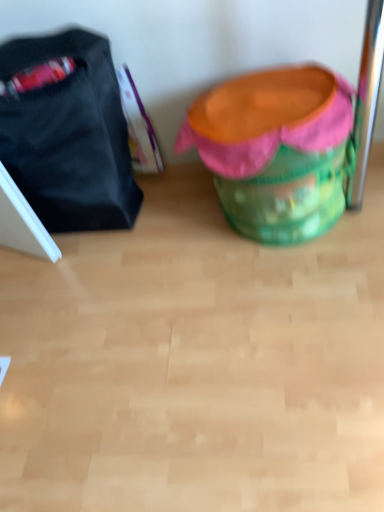
Question: Is green fabric bean bag chair at center to the left or to the right of matte black bag at left in the image?

Choices:
 (A) left
 (B) right

Answer: (B)

Question: From their relative heights in the image, would you say green fabric bean bag chair at center is taller or shorter than matte black bag at left?

Choices:
 (A) tall
 (B) short

Answer: (B)

Question: From a real-world perspective, is green fabric bean bag chair at center physically located above or below matte black bag at left?

Choices:
 (A) above
 (B) below

Answer: (B)

Question: Relative to green fabric bean bag chair at center, is matte black bag at left in front or behind?

Choices:
 (A) behind
 (B) front

Answer: (A)

Question: Is matte black bag at left wider or thinner than green fabric bean bag chair at center?

Choices:
 (A) thin
 (B) wide

Answer: (A)

Question: Based on their positions, is matte black bag at left located to the left or right of green fabric bean bag chair at center?

Choices:
 (A) right
 (B) left

Answer: (B)

Question: Is matte black bag at left taller or shorter than green fabric bean bag chair at center?

Choices:
 (A) short
 (B) tall

Answer: (B)